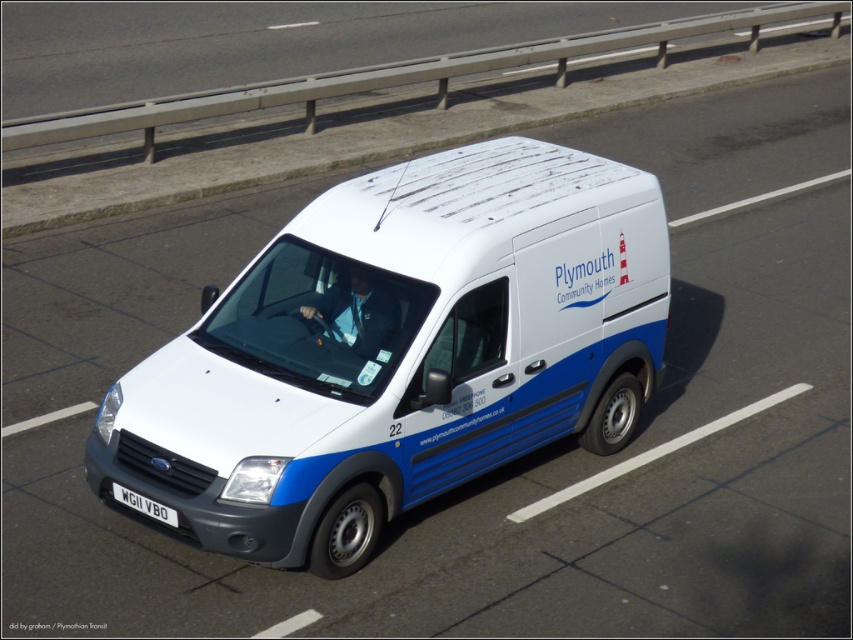
Question: Does white matte van at center appear under white plastic license plate at lower center?

Choices:
 (A) yes
 (B) no

Answer: (B)

Question: Is white matte van at center positioned before white plastic license plate at lower center?

Choices:
 (A) no
 (B) yes

Answer: (B)

Question: Among these points, which one is farthest from the camera?

Choices:
 (A) (172, 509)
 (B) (630, 337)

Answer: (B)

Question: Does white matte van at center appear over white plastic license plate at lower center?

Choices:
 (A) no
 (B) yes

Answer: (B)

Question: Which point appears closest to the camera in this image?

Choices:
 (A) (140, 502)
 (B) (332, 244)

Answer: (A)